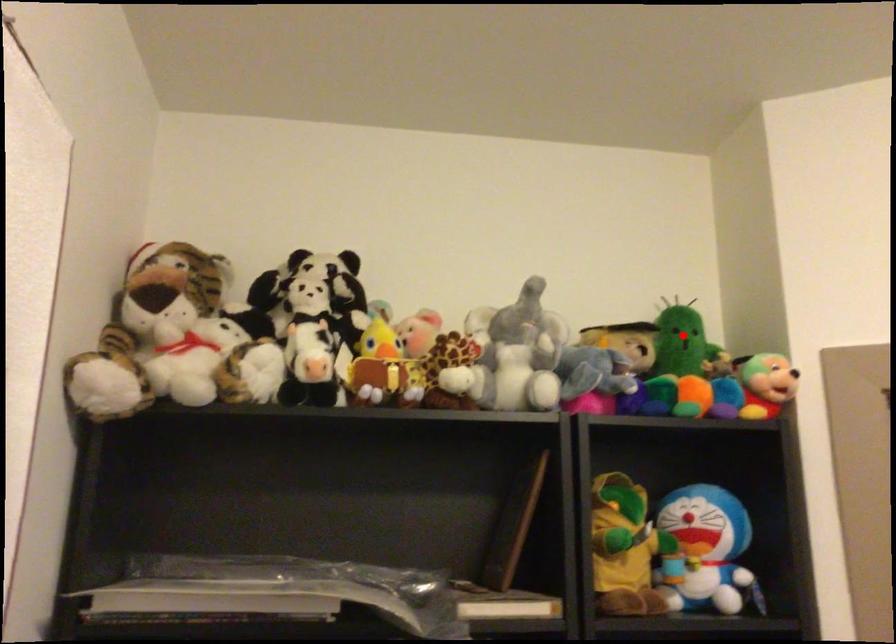
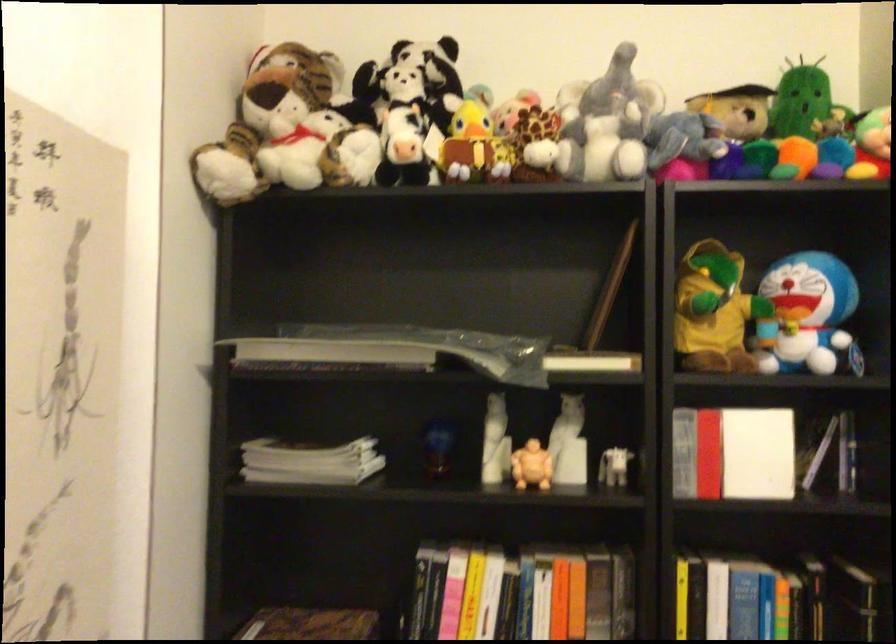
The point at the highlighted location is marked in the first image. Where is the corresponding point in the second image?

(799, 100)